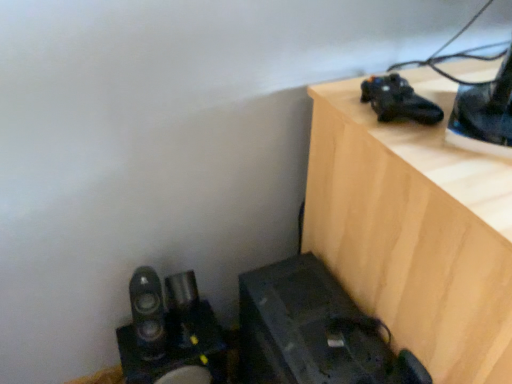
Question: Is black matte shoe at upper right positioned beyond the bounds of wooden table at upper right?

Choices:
 (A) yes
 (B) no

Answer: (A)

Question: Is black matte shoe at upper right surrounding wooden table at upper right?

Choices:
 (A) no
 (B) yes

Answer: (A)

Question: Is black matte shoe at upper right at the right side of wooden table at upper right?

Choices:
 (A) no
 (B) yes

Answer: (A)

Question: From a real-world perspective, is black matte shoe at upper right on wooden table at upper right?

Choices:
 (A) yes
 (B) no

Answer: (A)

Question: From the image's perspective, is black matte shoe at upper right on top of wooden table at upper right?

Choices:
 (A) no
 (B) yes

Answer: (B)

Question: Does point (182, 274) appear closer or farther from the camera than point (448, 152)?

Choices:
 (A) closer
 (B) farther

Answer: (B)

Question: Is satin black speakers at lower left in front of or behind wooden table at upper right in the image?

Choices:
 (A) behind
 (B) front

Answer: (A)

Question: Is satin black speakers at lower left wider or thinner than wooden table at upper right?

Choices:
 (A) wide
 (B) thin

Answer: (B)

Question: Looking at the image, does satin black speakers at lower left seem bigger or smaller compared to wooden table at upper right?

Choices:
 (A) big
 (B) small

Answer: (B)

Question: Relative to satin black speakers at lower left, is black matte shoe at upper right in front or behind?

Choices:
 (A) front
 (B) behind

Answer: (A)

Question: From the image's perspective, is black matte shoe at upper right above or below satin black speakers at lower left?

Choices:
 (A) above
 (B) below

Answer: (A)

Question: From their relative heights in the image, would you say black matte shoe at upper right is taller or shorter than satin black speakers at lower left?

Choices:
 (A) short
 (B) tall

Answer: (A)

Question: Would you say black matte shoe at upper right is to the left or to the right of satin black speakers at lower left in the picture?

Choices:
 (A) left
 (B) right

Answer: (B)

Question: From the image's perspective, relative to black matte shoe at upper right, is wooden table at upper right above or below?

Choices:
 (A) below
 (B) above

Answer: (A)

Question: Is point (482, 188) closer or farther from the camera than point (391, 92)?

Choices:
 (A) closer
 (B) farther

Answer: (A)